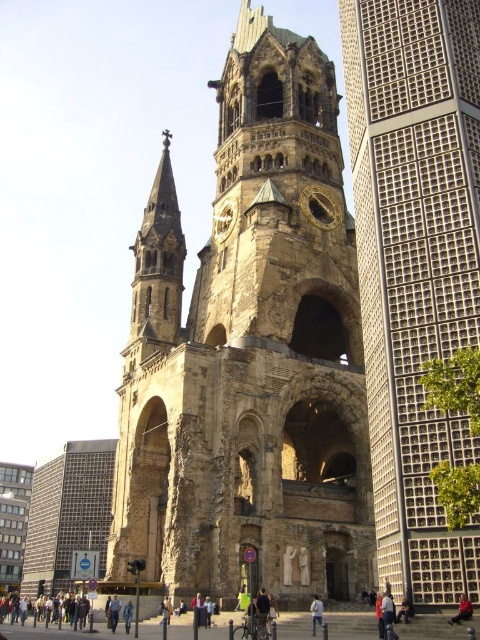
Question: From the image, what is the correct spatial relationship of gray concrete tower at right in relation to jeans at center?

Choices:
 (A) above
 (B) below

Answer: (A)

Question: Among these objects, which one is nearest to the camera?

Choices:
 (A) gold metallic clock at center
 (B) dark blue jeans at lower right

Answer: (B)

Question: Among these points, which one is nearest to the camera?

Choices:
 (A) (215, 211)
 (B) (456, 612)
 (C) (313, 609)
 (D) (384, 595)

Answer: (B)

Question: Considering the relative positions of brown stone tower at center and dark blue jeans at lower right in the image provided, where is brown stone tower at center located with respect to dark blue jeans at lower right?

Choices:
 (A) below
 (B) above

Answer: (A)

Question: Considering the real-world distances, which object is farthest from the gray concrete tower at right?

Choices:
 (A) gold metallic clock at center
 (B) jeans at center
 (C) stone tower at center

Answer: (B)

Question: Does red jacket at lower right have a greater width compared to blue denim jacket at lower center?

Choices:
 (A) no
 (B) yes

Answer: (B)